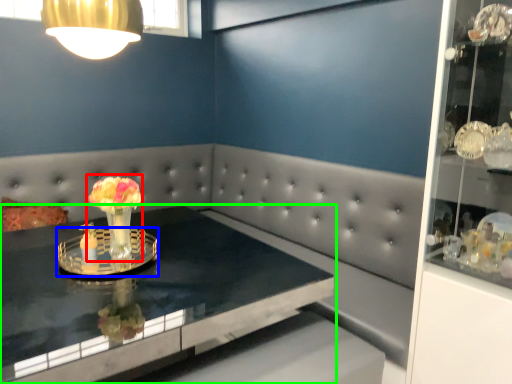
Question: Estimate the real-world distances between objects in this image. Which object is farther from floral arrangement (highlighted by a red box), glass plate (highlighted by a blue box) or table (highlighted by a green box)?

Choices:
 (A) glass plate
 (B) table

Answer: (B)